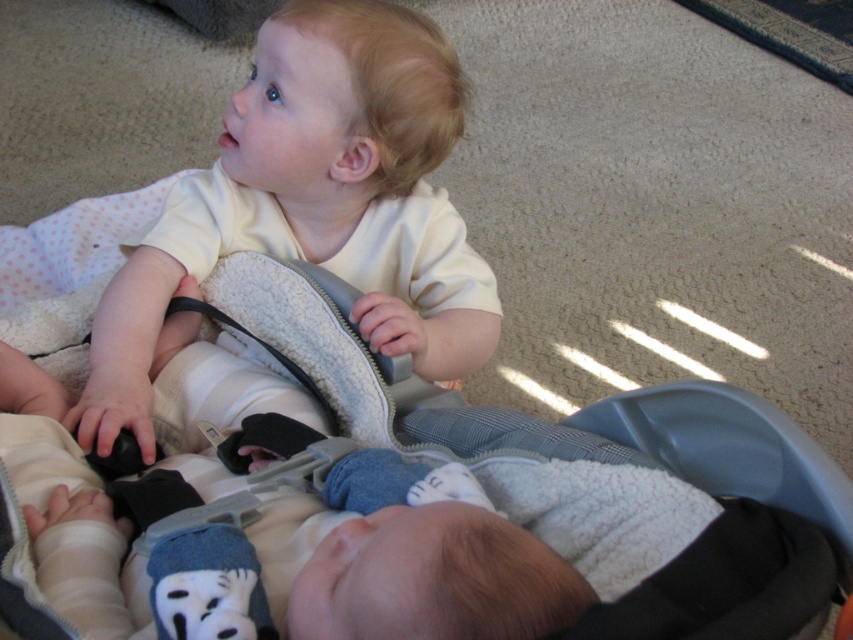
Question: Can you confirm if matte white onesie at center is wider than gray fabric baby carriage at center?

Choices:
 (A) yes
 (B) no

Answer: (B)

Question: Can you confirm if matte white onesie at center is wider than gray fabric baby carriage at center?

Choices:
 (A) no
 (B) yes

Answer: (A)

Question: Is matte white onesie at center positioned before gray fabric baby carriage at center?

Choices:
 (A) yes
 (B) no

Answer: (B)

Question: Among these objects, which one is nearest to the camera?

Choices:
 (A) gray fabric baby carriage at center
 (B) matte white onesie at center

Answer: (A)

Question: Among these objects, which one is farthest from the camera?

Choices:
 (A) gray fabric baby carriage at center
 (B) matte white onesie at center

Answer: (B)